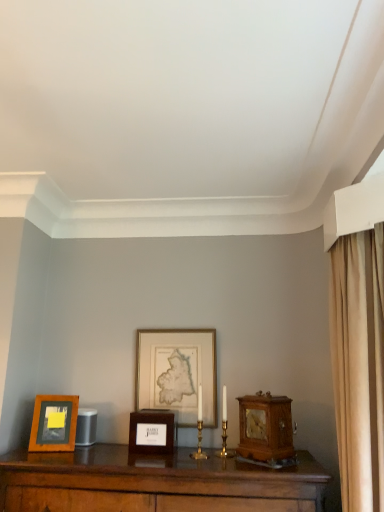
Question: From the image's perspective, relative to wooden alarm clock at right, is wooden picture frame at left, the third picture frame in the right-to-left sequence, above or below?

Choices:
 (A) below
 (B) above

Answer: (A)

Question: Considering the positions of point (62, 445) and point (259, 415), is point (62, 445) closer or farther from the camera than point (259, 415)?

Choices:
 (A) farther
 (B) closer

Answer: (A)

Question: Which object is the closest to the wooden picture frame at center, which is the 2th picture frame in right-to-left order?

Choices:
 (A) wooden alarm clock at right
 (B) wooden picture frame at left, the third picture frame in the right-to-left sequence
 (C) gold-framed map at center, which is the first picture frame in right-to-left order

Answer: (C)

Question: Which object is positioned farthest from the wooden alarm clock at right?

Choices:
 (A) wooden picture frame at center, which is the 2th picture frame in right-to-left order
 (B) wooden picture frame at left, which ranks as the first picture frame in left-to-right order
 (C) gold-framed map at center, the third picture frame from the left

Answer: (B)